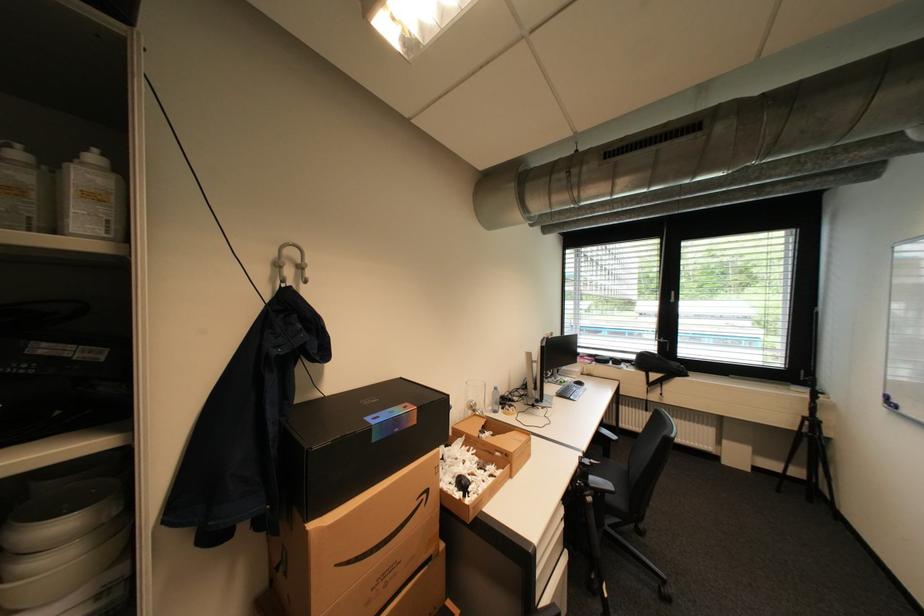
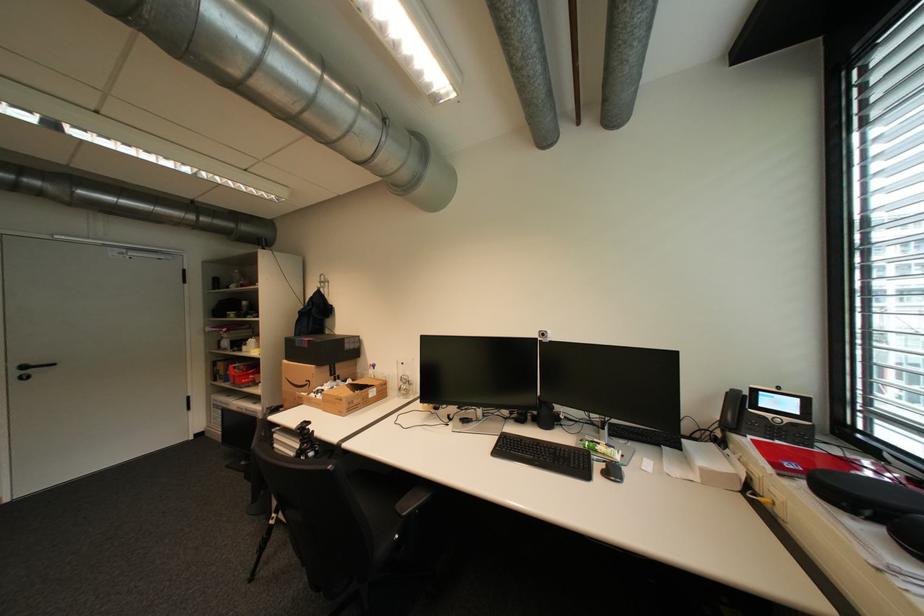
The point at (433, 496) is marked in the first image. Where is the corresponding point in the second image?

(317, 383)